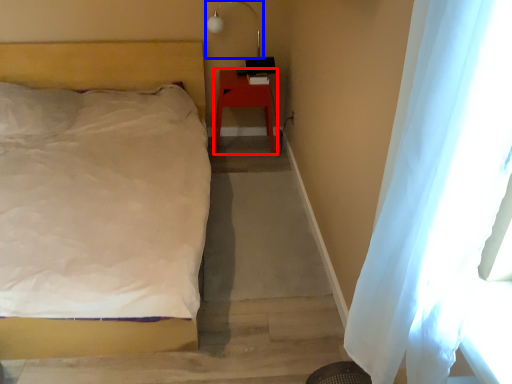
Question: Which object appears farthest to the camera in this image, furniture (highlighted by a red box) or lamp (highlighted by a blue box)?

Choices:
 (A) furniture
 (B) lamp

Answer: (A)